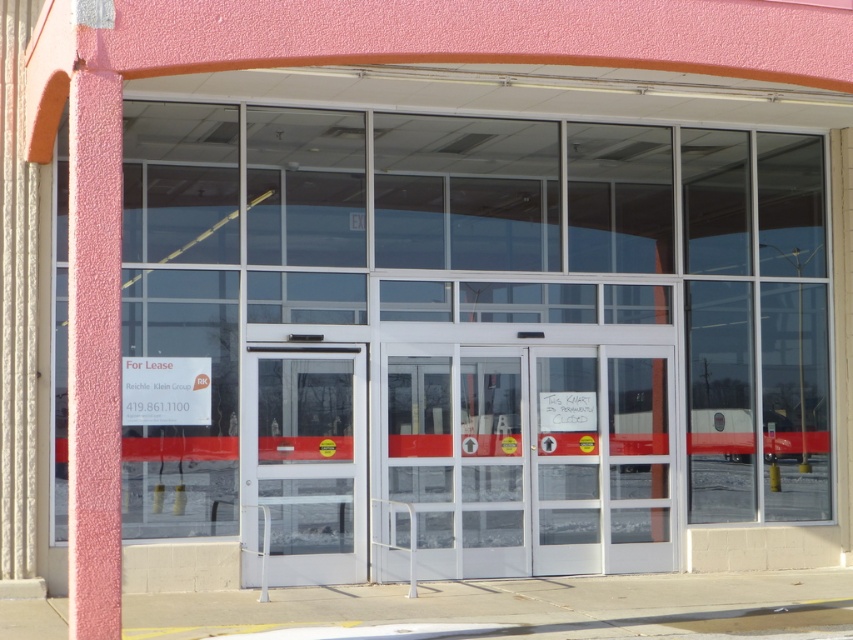
Can you confirm if pink textured pillar at left is thinner than transparent glass door at center?

Indeed, pink textured pillar at left has a lesser width compared to transparent glass door at center.

Who is higher up, pink textured pillar at left or transparent glass door at center?

Positioned higher is pink textured pillar at left.

Is point (109, 237) less distant than point (351, 472)?

Yes, it is in front of point (351, 472).

This screenshot has height=640, width=853. I want to click on pink textured pillar at left, so click(94, 355).